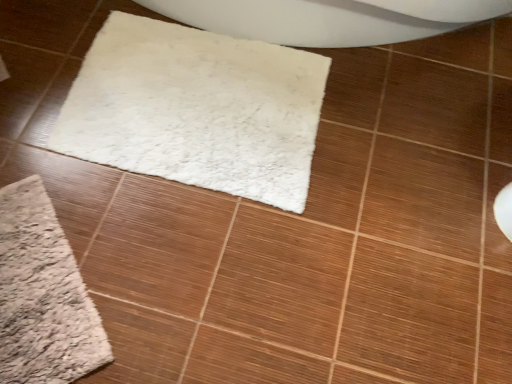
You are a GUI agent. You are given a task and a screenshot of the screen. Output one action in this format:
    pyautogui.click(x=<x>, y=<y>)
    Task: Click on the free space in front of white fluffy mat at center
    
    Given the screenshot: What is the action you would take?
    pyautogui.click(x=211, y=265)